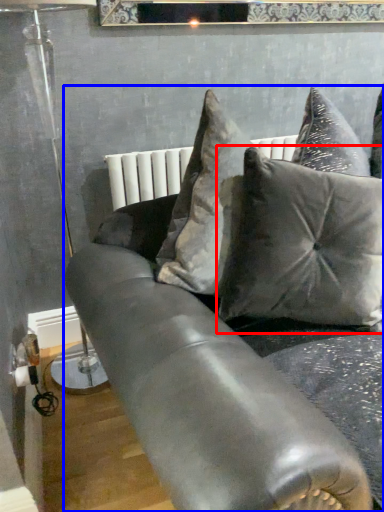
Question: Among these objects, which one is farthest to the camera, pillow (highlighted by a red box) or studio couch (highlighted by a blue box)?

Choices:
 (A) pillow
 (B) studio couch

Answer: (A)